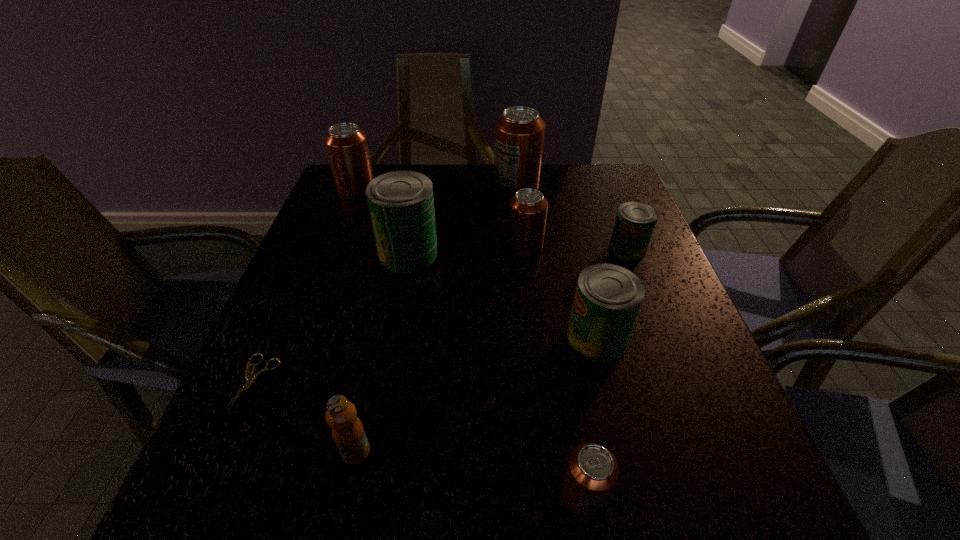
You are a GUI agent. You are given a task and a screenshot of the screen. Output one action in this format:
    pyautogui.click(x=<x>, y=<y>)
    Task: Click on the free space at the near edge of the desktop
    This screenshot has height=540, width=960.
    Given the screenshot: What is the action you would take?
    pyautogui.click(x=552, y=500)

You are a GUI agent. You are given a task and a screenshot of the screen. Output one action in this format:
    pyautogui.click(x=<x>, y=<y>)
    Task: Click on the vacant region at the left edge of the desktop
    This screenshot has width=960, height=540.
    Given the screenshot: What is the action you would take?
    pyautogui.click(x=361, y=254)

This screenshot has width=960, height=540. What are the coordinates of `vacant space at the right edge of the desktop` in the screenshot? It's located at (706, 409).

At what (x,y) coordinates should I click in order to perform the action: click on vacant area at the far left corner. Please return your answer as a coordinate pair (x, y). The width and height of the screenshot is (960, 540). Looking at the image, I should click on (335, 206).

Where is `vacant area at the far right corner of the desktop`? Image resolution: width=960 pixels, height=540 pixels. vacant area at the far right corner of the desktop is located at coordinates (611, 193).

At what (x,y) coordinates should I click in order to perform the action: click on vacant area at the near right corner of the desktop. Please return your answer as a coordinate pair (x, y). Image resolution: width=960 pixels, height=540 pixels. Looking at the image, I should click on (725, 511).

This screenshot has width=960, height=540. What are the coordinates of `free spot between the biggest green can and the nearest green can` in the screenshot? It's located at (503, 295).

This screenshot has width=960, height=540. What are the coordinates of `vacant region between the shortest object and the second biggest orange can` in the screenshot? It's located at (306, 285).

What are the coordinates of `free space between the second smallest orange can and the second biggest green can` in the screenshot? It's located at (561, 292).

Find the location of a particular element. vacant space in between the second smallest green can and the biggest orange can is located at coordinates (557, 262).